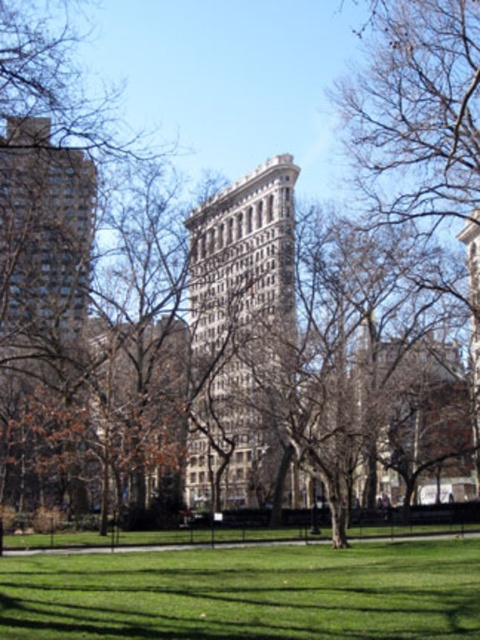
You are a photographer planning to capture a photo of the brown leafless tree at center and the matte glass building at left. Based on their positions, which object should you place on the left side of your camera frame to ensure both are visible?

The brown leafless tree at center is positioned on the right side of matte glass building at left, so to ensure both are visible, you should place the matte glass building at left on the left side of your camera frame.

You are standing in the park area in front of the Flatiron Building and want to take a photo of the matte glass building at left. If your camera can focus on objects up to 65 meters away, will you need to move closer to get a clear shot?

The matte glass building at left is 67.08 meters from the viewer, which is beyond the camera focus limit of 65 meters. Therefore, you need to move closer to ensure the building is in focus.

You are standing in the park and want to take a photo of the white stone building at center and the matte glass building at left. Which building should you position yourself closer to if you want both structures to appear equally sized in your camera frame?

You should position yourself closer to the matte glass building at left because it is farther away from you compared to the white stone building at center. Since the white stone building at center is to the right of the matte glass building at left, moving closer to the farther building will help balance their sizes in the photo.